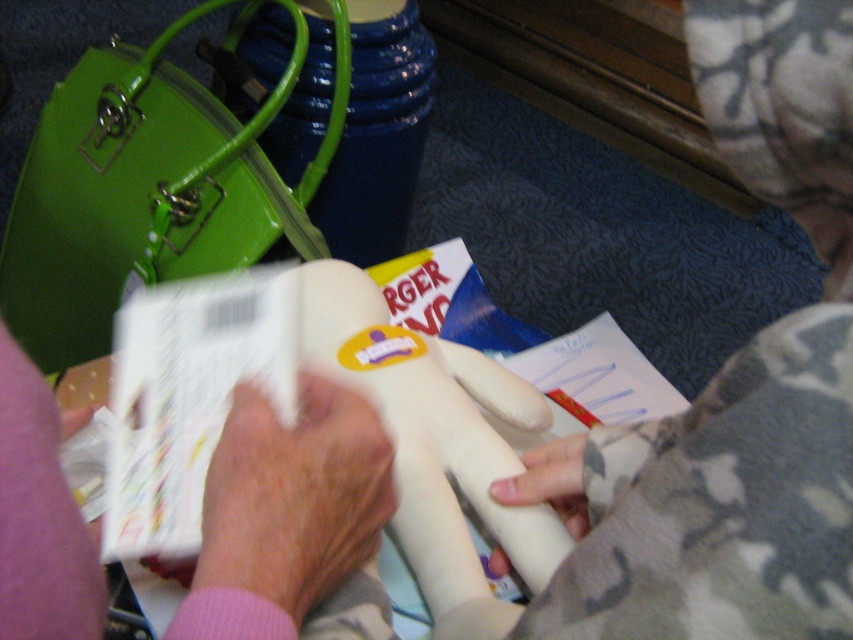
Identify the location of pink fabric at center. pyautogui.click(x=293, y=499).

Locate an element on the screen. The height and width of the screenshot is (640, 853). pink fabric at center is located at coordinates (293, 499).

At what (x,y) coordinates should I click in order to perform the action: click on pink fabric at center. Please return your answer as a coordinate pair (x, y). The width and height of the screenshot is (853, 640). Looking at the image, I should click on (293, 499).